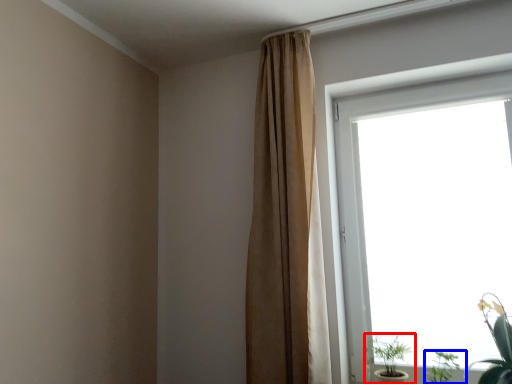
Question: Which object is further to the camera taking this photo, houseplant (highlighted by a red box) or houseplant (highlighted by a blue box)?

Choices:
 (A) houseplant
 (B) houseplant

Answer: (A)